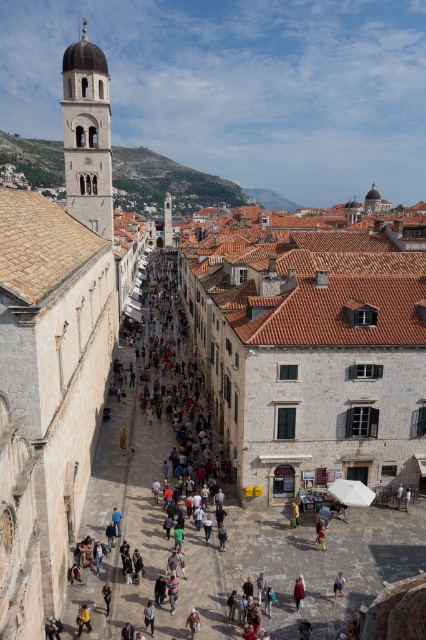
Question: Is white stone tower at upper left positioned in front of light blue denim jeans at lower center?

Choices:
 (A) yes
 (B) no

Answer: (B)

Question: Which point is farther to the camera?

Choices:
 (A) (333, 589)
 (B) (144, 620)
 (C) (169, 237)

Answer: (C)

Question: Does yellow fabric person at center come in front of red wool coat at lower center?

Choices:
 (A) no
 (B) yes

Answer: (B)

Question: Which is nearer to the yellow fabric person at center?

Choices:
 (A) red wool coat at lower center
 (B) white stone tower at upper left

Answer: (A)

Question: Which of the following is the closest to the observer?

Choices:
 (A) (66, 104)
 (B) (83, 620)
 (C) (334, 584)
 (D) (106, 596)

Answer: (B)

Question: Can you confirm if smooth stone tower at center is positioned above light blue denim jeans at center?

Choices:
 (A) yes
 (B) no

Answer: (A)